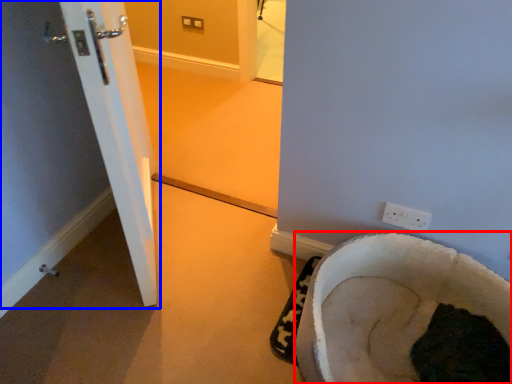
Question: Which object is further to the camera taking this photo, furniture (highlighted by a red box) or door (highlighted by a blue box)?

Choices:
 (A) furniture
 (B) door

Answer: (B)